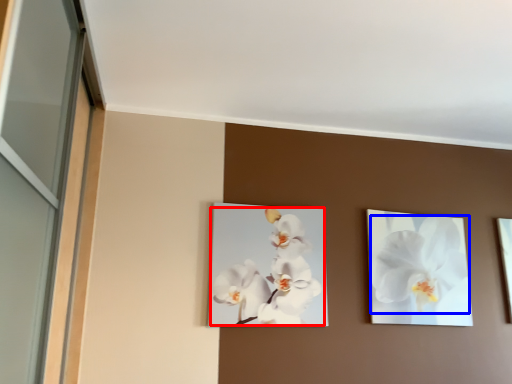
Question: Among these objects, which one is farthest to the camera, flower (highlighted by a red box) or flower (highlighted by a blue box)?

Choices:
 (A) flower
 (B) flower

Answer: (B)